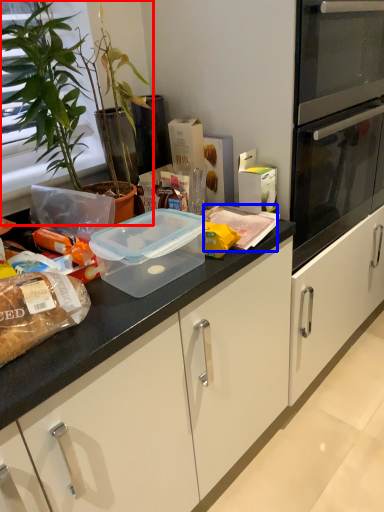
Question: Which point is further to the camera, houseplant (highlighted by a red box) or food (highlighted by a blue box)?

Choices:
 (A) houseplant
 (B) food

Answer: (B)